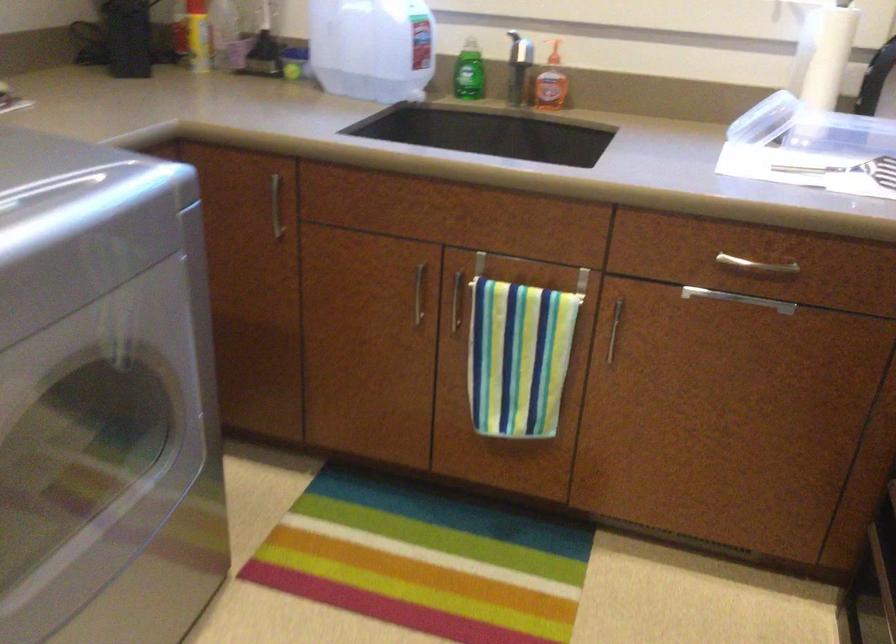
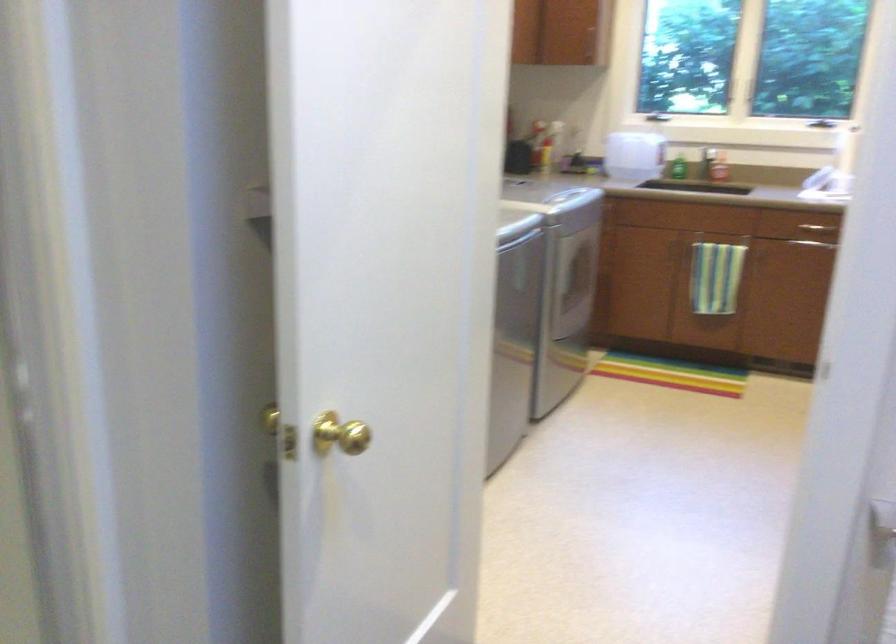
Where in the second image is the point corresponding to point 461,89 from the first image?

(676, 167)